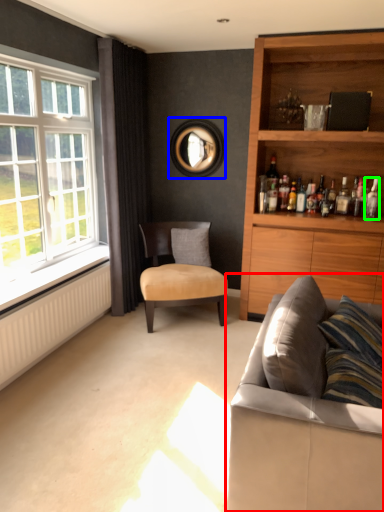
Question: Which object is the farthest from studio couch (highlighted by a red box)? Choose among these: picture frame (highlighted by a blue box) or bottle (highlighted by a green box).

Choices:
 (A) picture frame
 (B) bottle

Answer: (A)